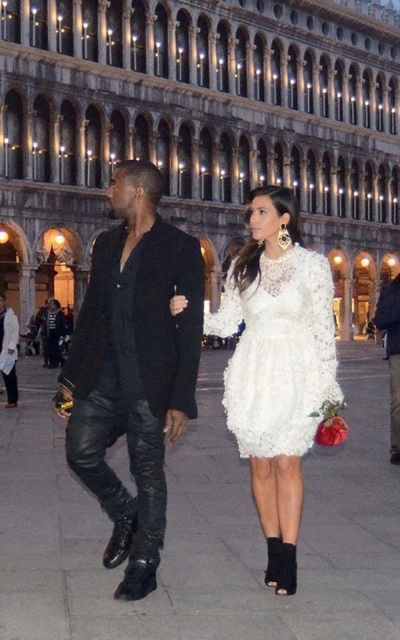
Question: Which object appears closest to the camera in this image?

Choices:
 (A) black leather pants at lower left
 (B) white lace dress at center
 (C) black leather pants at center

Answer: (C)

Question: Does black leather pants at center lie in front of black leather pants at lower left?

Choices:
 (A) yes
 (B) no

Answer: (A)

Question: Can you confirm if white lace dress at center is positioned below black leather pants at lower left?

Choices:
 (A) no
 (B) yes

Answer: (B)

Question: Among these objects, which one is farthest from the camera?

Choices:
 (A) black leather pants at center
 (B) white lace dress at center

Answer: (B)

Question: Among these points, which one is nearest to the camera?

Choices:
 (A) (330, 282)
 (B) (386, 348)
 (C) (115, 554)

Answer: (C)

Question: Does white lace dress at center have a lesser width compared to black leather pants at lower left?

Choices:
 (A) yes
 (B) no

Answer: (A)